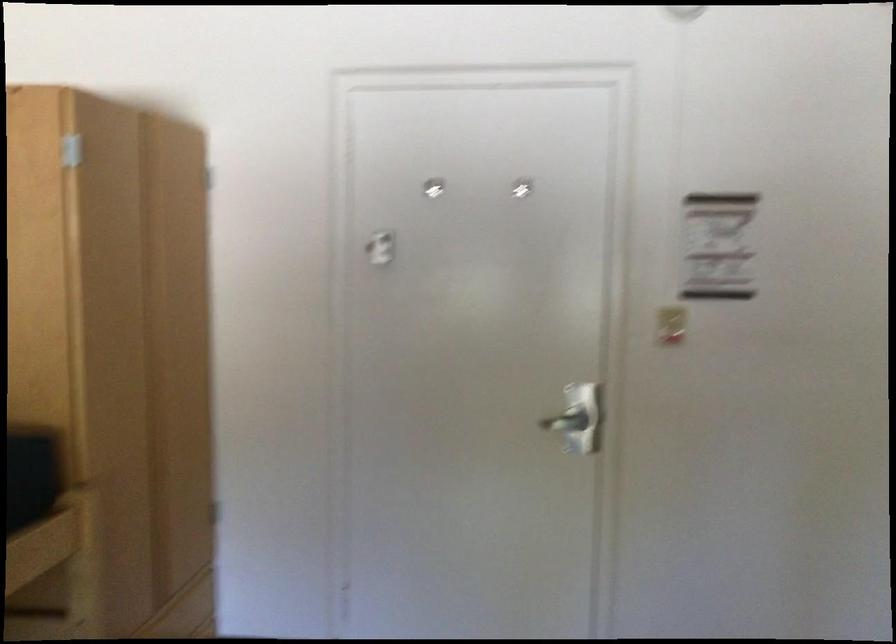
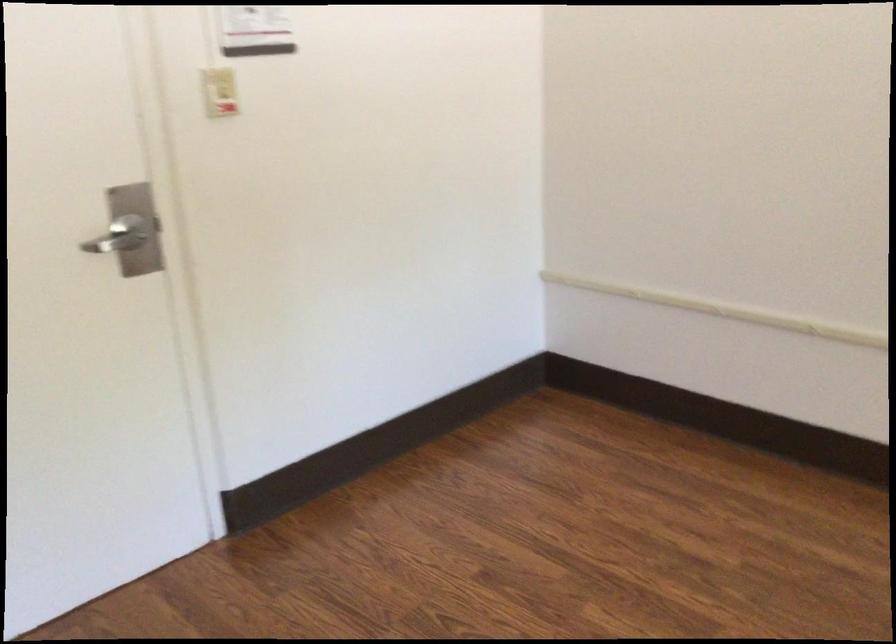
First-person continuous shooting, in which direction is the camera rotating?

The camera's rotation is toward right-down.